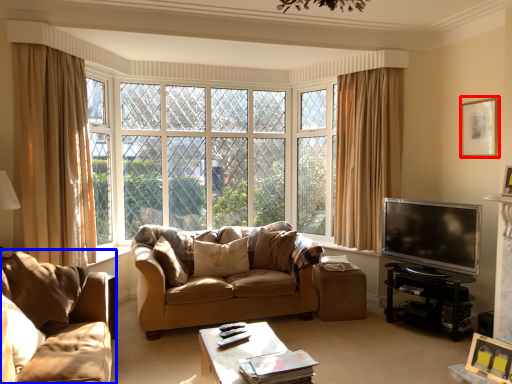
Question: Among these objects, which one is nearest to the camera, picture frame (highlighted by a red box) or studio couch (highlighted by a blue box)?

Choices:
 (A) picture frame
 (B) studio couch

Answer: (B)